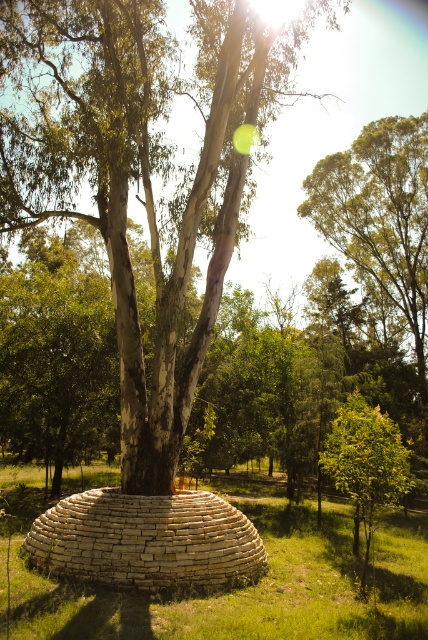
You are a bird looking for a place to perch. You see the white stone dome at center and the green leafy tree at center. Which one is taller?

The white stone dome at center is taller than the green leafy tree at center, so the bird should choose the white stone dome at center to perch on if it prefers a higher spot.

From the picture: You are standing at the center of the circular stone ring around the smooth bark tree at center. If you walk straight ahead, will you be facing the tree?

Yes, because the smooth bark tree at center is located at point (142, 168), which is directly in front of you when standing at the center of the circular stone ring.

From the picture: You are standing in the forest and want to take a photo of both the smooth bark tree at center and the white stone dome at center. Which object should you focus on first to ensure it appears sharp in the foreground?

You should focus on the smooth bark tree at center first because it is closer to you than the white stone dome at center, making it the foreground object.